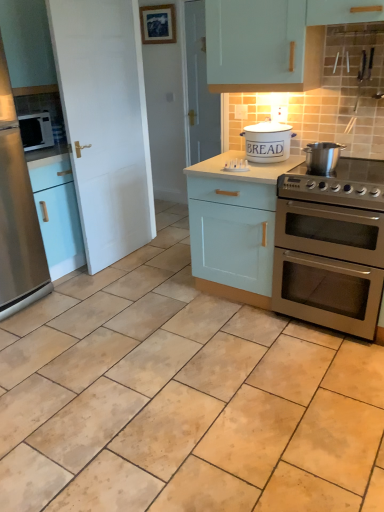
Locate an element on the screen. This screenshot has width=384, height=512. vacant space in front of white ceramic bread bin at center, the 1th appliance from the back is located at coordinates (264, 170).